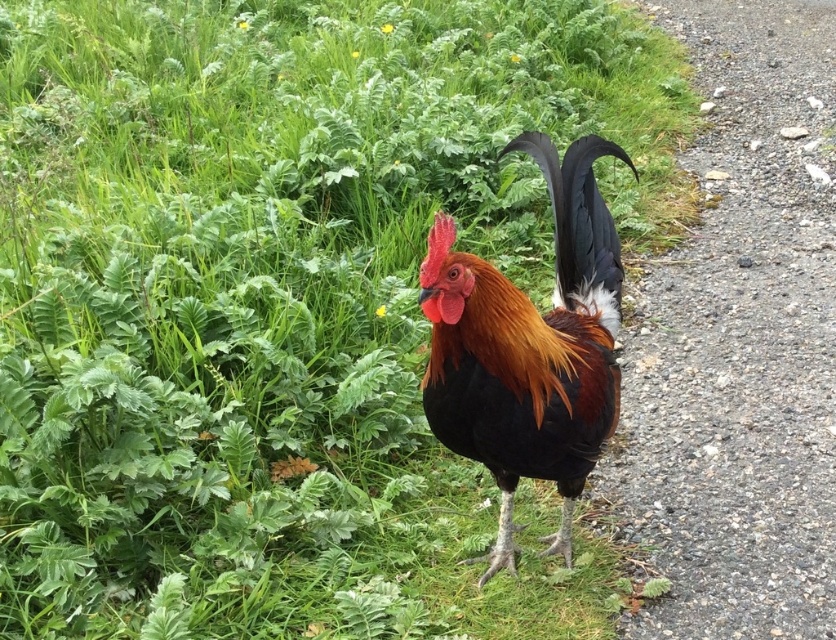
Image resolution: width=836 pixels, height=640 pixels. Describe the element at coordinates (740, 342) in the screenshot. I see `gravelly path at right` at that location.

Between point (763, 508) and point (506, 440), which one is positioned in front?

Point (506, 440) is in front.

In order to click on gravelly path at right in this screenshot , I will do `click(740, 342)`.